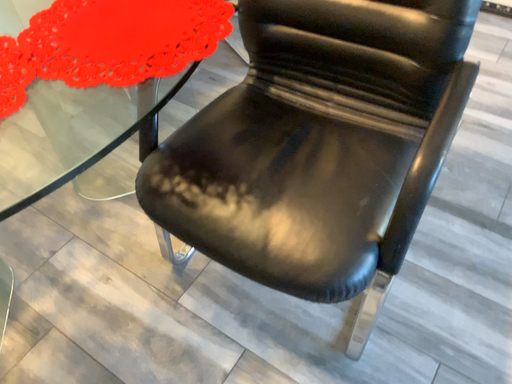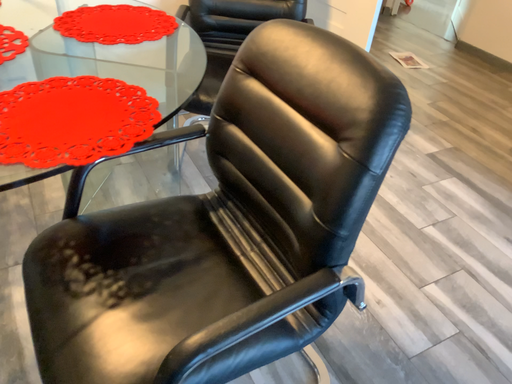
Question: How did the camera likely rotate when shooting the video?

Choices:
 (A) rotated upward
 (B) rotated downward

Answer: (A)